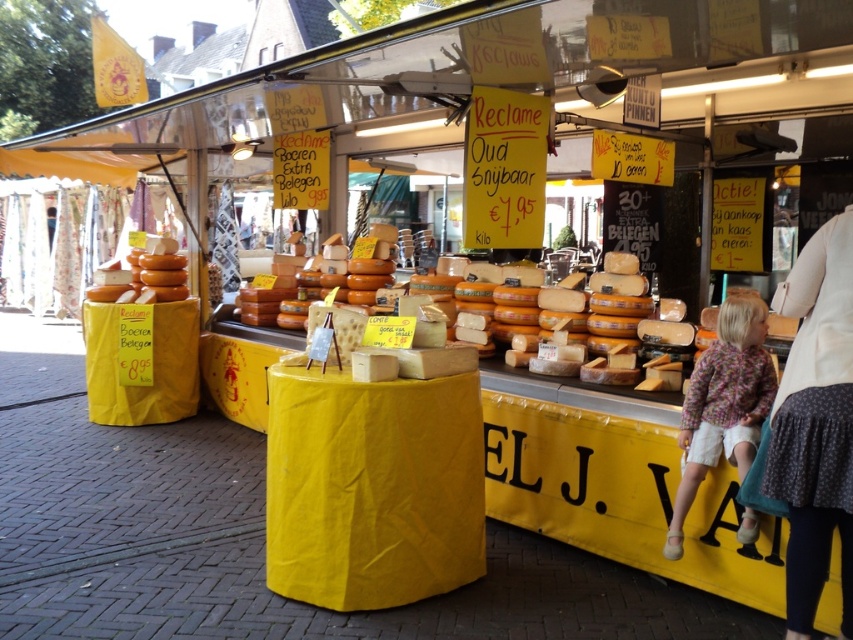
Who is taller, floral fabric skirt at lower right or floral-patterned fabric at lower right?

With more height is floral fabric skirt at lower right.

Is point (782, 403) positioned in front of point (735, 424)?

Yes.

Identify the location of floral fabric skirt at lower right. (815, 422).

Which is more to the right, orange cheese at center or matte brown cheese at center?

From the viewer's perspective, orange cheese at center appears more on the right side.

Can you confirm if orange cheese at center is taller than matte brown cheese at center?

Incorrect, orange cheese at center's height is not larger of matte brown cheese at center's.

Where is `orange cheese at center`? The width and height of the screenshot is (853, 640). orange cheese at center is located at coordinates (560, 385).

This screenshot has width=853, height=640. Identify the location of orange cheese at center. (560, 385).

This screenshot has height=640, width=853. Describe the element at coordinates (815, 422) in the screenshot. I see `floral fabric skirt at lower right` at that location.

Between point (850, 513) and point (132, 296), which one is positioned in front?

Point (850, 513) is more forward.

This screenshot has width=853, height=640. In order to click on floral fabric skirt at lower right in this screenshot , I will do `click(815, 422)`.